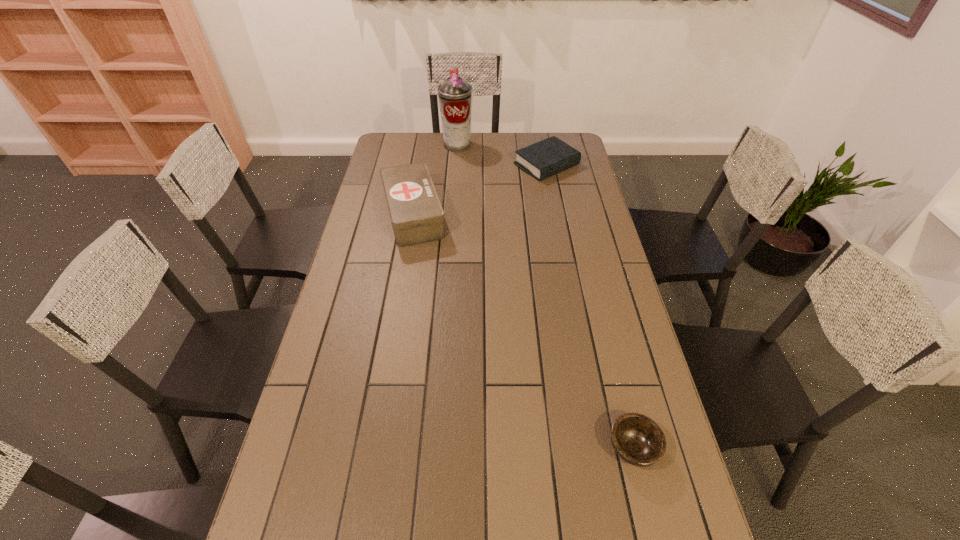
You are a GUI agent. You are given a task and a screenshot of the screen. Output one action in this format:
    pyautogui.click(x=<x>, y=<y>)
    Task: Click on the free spot between the second tallest object and the bowl
    The width and height of the screenshot is (960, 540).
    Given the screenshot: What is the action you would take?
    pyautogui.click(x=523, y=331)

At what (x,y) coordinates should I click in order to perform the action: click on vacant point located between the bowl and the first-aid kit. Please return your answer as a coordinate pair (x, y). The image size is (960, 540). Looking at the image, I should click on (523, 331).

Locate an element on the screen. Image resolution: width=960 pixels, height=540 pixels. unoccupied area between the first-aid kit and the Bible is located at coordinates (480, 190).

Locate an element on the screen. Image resolution: width=960 pixels, height=540 pixels. free space between the Bible and the first-aid kit is located at coordinates (480, 190).

Where is `vacant point located between the Bible and the aerosol can`? The width and height of the screenshot is (960, 540). vacant point located between the Bible and the aerosol can is located at coordinates (502, 155).

Identify the location of empty space that is in between the Bible and the tallest object. This screenshot has width=960, height=540. (502, 155).

The image size is (960, 540). I want to click on free space between the Bible and the tallest object, so click(x=502, y=155).

Where is `vacant space that is in between the tallest object and the second tallest object`? This screenshot has width=960, height=540. vacant space that is in between the tallest object and the second tallest object is located at coordinates (435, 180).

You are a GUI agent. You are given a task and a screenshot of the screen. Output one action in this format:
    pyautogui.click(x=<x>, y=<y>)
    Task: Click on the free spot between the aerosol can and the Bible
    The height and width of the screenshot is (540, 960).
    Given the screenshot: What is the action you would take?
    pyautogui.click(x=502, y=155)

The width and height of the screenshot is (960, 540). I want to click on object that is the second closest to the third shortest object, so click(x=543, y=159).